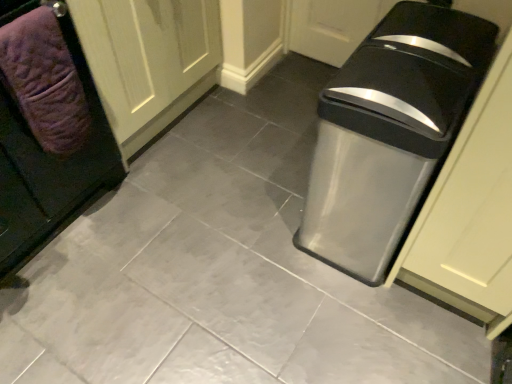
Find the location of a particular element. This screenshot has height=384, width=512. purple textured towel at left is located at coordinates (44, 81).

What is the approximate width of white wood door at upper left?

It is 61.65 centimeters.

In order to face metallic gray trash can at right, should I rotate leftwards or rightwards?

You should look right and rotate roughly 16.391 degrees.

Where is `purple quilted towel at left`? This screenshot has width=512, height=384. purple quilted towel at left is located at coordinates (47, 130).

Which is in front, metallic gray trash can at right or white wood door at upper left?

Positioned in front is metallic gray trash can at right.

Would you say metallic gray trash can at right is a long distance from white wood door at upper left?

No, there isn't a large distance between metallic gray trash can at right and white wood door at upper left.

Considering the relative sizes of metallic gray trash can at right and white wood door at upper left in the image provided, is metallic gray trash can at right shorter than white wood door at upper left?

Yes.

Which of these two, metallic gray trash can at right or white wood door at upper left, is thinner?

Thinner between the two is metallic gray trash can at right.

Is the surface of purple quilted towel at left in direct contact with purple textured towel at left?

Yes, purple quilted towel at left is with purple textured towel at left.

Does point (23, 57) come farther from viewer compared to point (82, 94)?

No, (23, 57) is closer to viewer.

Could you tell me if purple quilted towel at left is turned towards purple textured towel at left?

Yes, purple quilted towel at left is turned towards purple textured towel at left.

From the image's perspective, is purple quilted towel at left above white wood door at upper left?

No, from the image's perspective, purple quilted towel at left is not over white wood door at upper left.

Considering the relative sizes of purple quilted towel at left and white wood door at upper left in the image provided, is purple quilted towel at left wider than white wood door at upper left?

Correct, the width of purple quilted towel at left exceeds that of white wood door at upper left.

From a real-world perspective, which object stands above the other?

In real-world perspective, purple quilted towel at left is above.

Is purple textured towel at left far from purple quilted towel at left?

No, there isn't a large distance between purple textured towel at left and purple quilted towel at left.

Is purple textured towel at left situated inside purple quilted towel at left or outside?

purple textured towel at left is spatially positioned inside purple quilted towel at left.

Is purple textured towel at left turned away from purple quilted towel at left?

Yes, purple textured towel at left is facing away from purple quilted towel at left.

Is purple textured towel at left far from metallic gray trash can at right?

No, there isn't a large distance between purple textured towel at left and metallic gray trash can at right.

Is purple textured towel at left taller or shorter than metallic gray trash can at right?

purple textured towel at left is shorter than metallic gray trash can at right.

Considering their positions, is purple textured towel at left located in front of or behind metallic gray trash can at right?

purple textured towel at left is positioned farther from the viewer than metallic gray trash can at right.

Who is smaller, purple textured towel at left or metallic gray trash can at right?

With smaller size is purple textured towel at left.

Can purple textured towel at left be found inside metallic gray trash can at right?

That's incorrect, purple textured towel at left is not inside metallic gray trash can at right.

How far apart are metallic gray trash can at right and purple textured towel at left?

The distance of metallic gray trash can at right from purple textured towel at left is 83.29 centimeters.

In order to click on waste container located on the right of purple textured towel at left in this screenshot , I will do `click(389, 132)`.

From a real-world perspective, does metallic gray trash can at right stand above purple textured towel at left?

Incorrect, from a real-world perspective, metallic gray trash can at right is lower than purple textured towel at left.

From a real-world perspective, is metallic gray trash can at right beneath purple quilted towel at left?

Yes, from a real-world perspective, metallic gray trash can at right is below purple quilted towel at left.

Measure the distance between metallic gray trash can at right and purple quilted towel at left.

metallic gray trash can at right and purple quilted towel at left are 85.04 centimeters apart.

Does metallic gray trash can at right have a lesser width compared to purple quilted towel at left?

Yes, metallic gray trash can at right is thinner than purple quilted towel at left.

The width and height of the screenshot is (512, 384). Find the location of `waste container below the purple quilted towel at left (from a real-world perspective)`. waste container below the purple quilted towel at left (from a real-world perspective) is located at coordinates (389, 132).

Identify the location of waste container that is below the white wood door at upper left (from the image's perspective). The image size is (512, 384). (389, 132).

Locate an element on the screen. This screenshot has height=384, width=512. cabinetry that appears in front of the purple textured towel at left is located at coordinates (47, 130).

When comparing their distances from white wood door at upper left, does purple textured towel at left or purple quilted towel at left seem closer?

Among the two, purple quilted towel at left is located nearer to white wood door at upper left.

Estimate the real-world distances between objects in this image. Which object is closer to purple quilted towel at left, white wood door at upper left or metallic gray trash can at right?

white wood door at upper left lies closer to purple quilted towel at left than the other object.

From the image, which object appears to be nearer to metallic gray trash can at right, purple quilted towel at left or white wood door at upper left?

Based on the image, white wood door at upper left appears to be nearer to metallic gray trash can at right.

When comparing their distances from purple quilted towel at left, does white wood door at upper left or purple textured towel at left seem further?

Among the two, white wood door at upper left is located further to purple quilted towel at left.

When comparing their distances from white wood door at upper left, does metallic gray trash can at right or purple textured towel at left seem further?

metallic gray trash can at right lies further to white wood door at upper left than the other object.

When comparing their distances from metallic gray trash can at right, does white wood door at upper left or purple textured towel at left seem closer?

purple textured towel at left lies closer to metallic gray trash can at right than the other object.

From the image, which object appears to be nearer to white wood door at upper left, purple quilted towel at left or purple textured towel at left?

purple quilted towel at left lies closer to white wood door at upper left than the other object.

When comparing their distances from purple textured towel at left, does purple quilted towel at left or metallic gray trash can at right seem further?

Among the two, metallic gray trash can at right is located further to purple textured towel at left.

I want to click on door situated between purple quilted towel at left and metallic gray trash can at right from left to right, so click(148, 58).

This screenshot has width=512, height=384. I want to click on blanket located between purple quilted towel at left and metallic gray trash can at right in the left-right direction, so click(44, 81).

The image size is (512, 384). I want to click on blanket between white wood door at upper left and purple quilted towel at left in the vertical direction, so click(x=44, y=81).

Where is `blanket between white wood door at upper left and metallic gray trash can at right in the horizontal direction`? The height and width of the screenshot is (384, 512). blanket between white wood door at upper left and metallic gray trash can at right in the horizontal direction is located at coordinates (44, 81).